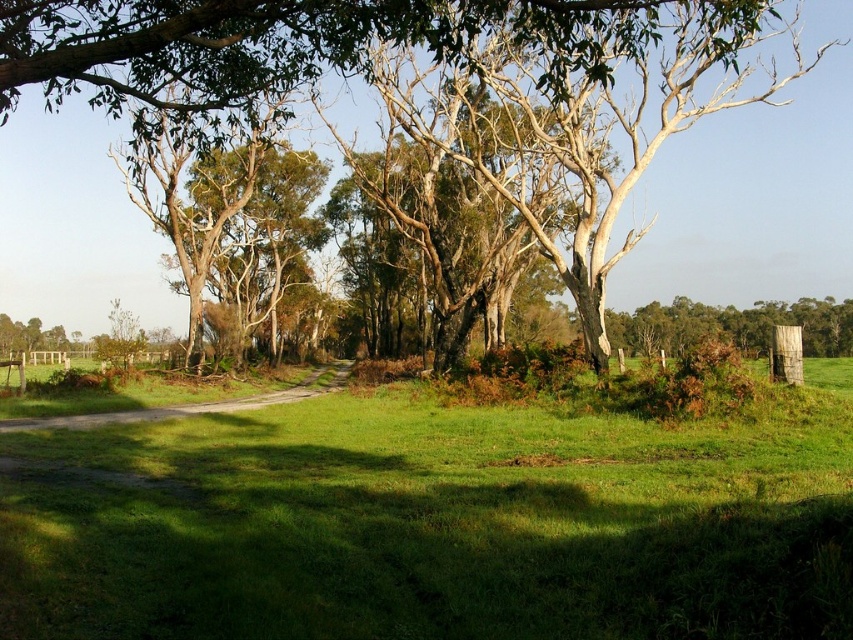
You are a hiker trying to determine the best path through the rural landscape. You see the green leafy tree at center and the dirt road at center. Which object would cast a longer shadow on the ground?

The green leafy tree at center is taller than the dirt road at center, so it would cast a longer shadow on the ground.